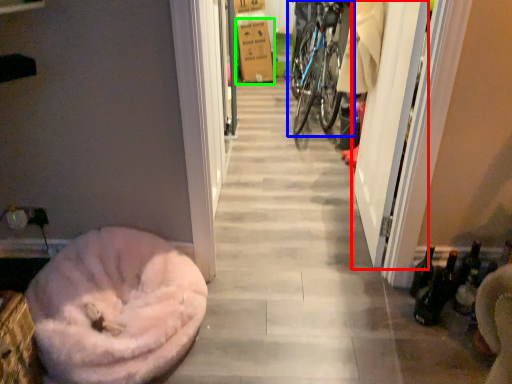
Question: Estimate the real-world distances between objects in this image. Which object is closer to screen door (highlighted by a red box), bicycle (highlighted by a blue box) or cardboard box (highlighted by a green box)?

Choices:
 (A) bicycle
 (B) cardboard box

Answer: (A)